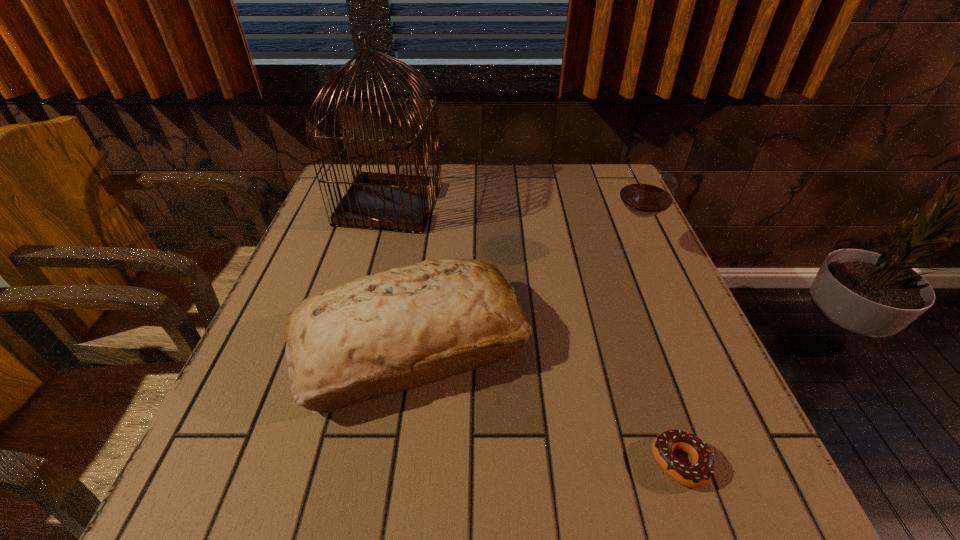
Find the location of a particular element. This screenshot has width=960, height=540. free space located on the back of the second shortest object is located at coordinates (433, 195).

Image resolution: width=960 pixels, height=540 pixels. Identify the location of free region located on the back of the doughnut. (620, 287).

I want to click on object present at the far edge, so click(x=397, y=202).

Find the location of a particular element. object present at the near edge is located at coordinates (696, 475).

At what (x,y) coordinates should I click in order to perform the action: click on birdcage that is at the left edge. Please return your answer as a coordinate pair (x, y). The width and height of the screenshot is (960, 540). Looking at the image, I should click on (x=397, y=202).

Image resolution: width=960 pixels, height=540 pixels. In order to click on bread at the left edge in this screenshot , I will do `click(377, 335)`.

Locate an element on the screen. The width and height of the screenshot is (960, 540). wineglass that is at the right edge is located at coordinates (647, 192).

You are a GUI agent. You are given a task and a screenshot of the screen. Output one action in this format:
    pyautogui.click(x=<x>, y=<y>)
    Task: Click on the doughnut that is at the right edge
    The width and height of the screenshot is (960, 540).
    Given the screenshot: What is the action you would take?
    pyautogui.click(x=696, y=475)

This screenshot has height=540, width=960. I want to click on object that is at the far left corner, so click(x=397, y=202).

Image resolution: width=960 pixels, height=540 pixels. What are the coordinates of `object located at the near right corner` in the screenshot? It's located at (696, 475).